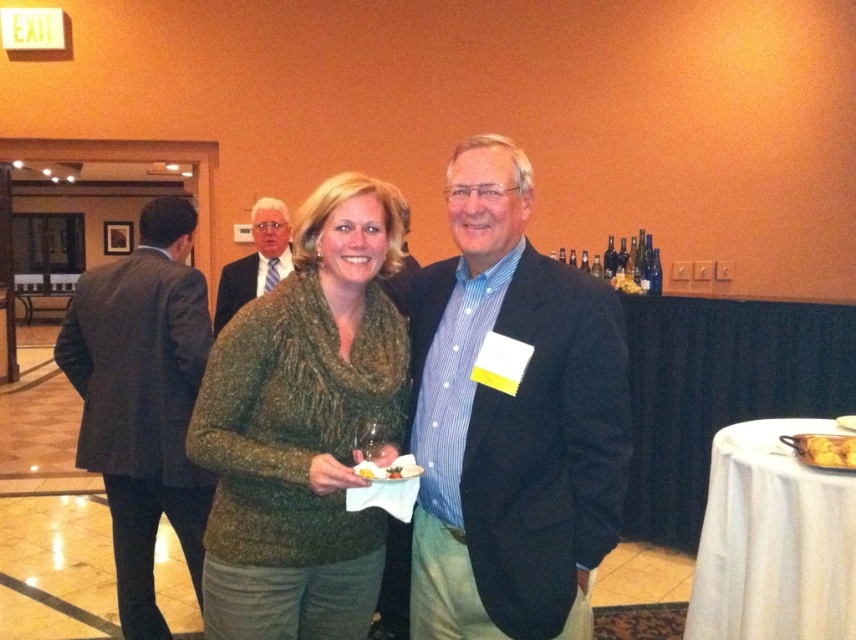
Question: Which of the following is the farthest from the observer?

Choices:
 (A) golden crispy bread at lower right
 (B) dark gray suit at left
 (C) green textured sweater at center

Answer: (B)

Question: Does matte black suit at upper left appear on the right side of golden crispy bread at lower right?

Choices:
 (A) yes
 (B) no

Answer: (B)

Question: Which point is farther from the camera taking this photo?

Choices:
 (A) (468, 525)
 (B) (144, 630)

Answer: (B)

Question: Does blue striped shirt at center appear on the left side of matte black suit at upper left?

Choices:
 (A) no
 (B) yes

Answer: (A)

Question: Which of these objects is positioned farthest from the green textured sweater at center?

Choices:
 (A) golden crispy bread at lower right
 (B) dark gray suit at left

Answer: (B)

Question: Is green textured sweater at center wider than golden crispy bread at lower right?

Choices:
 (A) yes
 (B) no

Answer: (A)